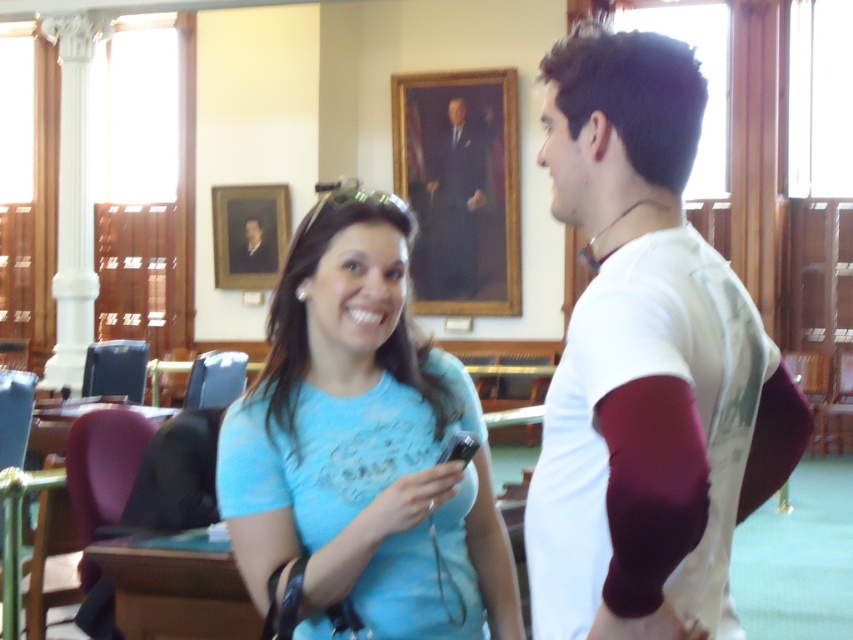
Is the position of blue cotton shirt at center less distant than that of white cotton t-shirt at center?

Yes.

Who is positioned more to the right, blue cotton shirt at center or white cotton t-shirt at center?

From the viewer's perspective, white cotton t-shirt at center appears more on the right side.

Image resolution: width=853 pixels, height=640 pixels. I want to click on blue cotton shirt at center, so click(646, 364).

From the picture: Does blue cotton shirt at center lie behind formal suit at center?

→ No, blue cotton shirt at center is closer to the viewer.

Between blue cotton shirt at center and formal suit at center, which one has more height?

Standing taller between the two is formal suit at center.

Between point (560, 541) and point (456, 189), which one is positioned in front?

Point (560, 541)

At what (x,y) coordinates should I click in order to perform the action: click on blue cotton shirt at center. Please return your answer as a coordinate pair (x, y). The height and width of the screenshot is (640, 853). Looking at the image, I should click on (646, 364).

From the picture: Is white cotton t-shirt at center closer to the viewer compared to formal suit at center?

That is True.

Is white cotton t-shirt at center positioned at the back of formal suit at center?

No, white cotton t-shirt at center is in front of formal suit at center.

Is point (735, 307) positioned after point (479, 234)?

No, it is not.

You are a GUI agent. You are given a task and a screenshot of the screen. Output one action in this format:
    pyautogui.click(x=<x>, y=<y>)
    Task: Click on the white cotton t-shirt at center
    Image resolution: width=853 pixels, height=640 pixels.
    Given the screenshot: What is the action you would take?
    pyautogui.click(x=646, y=364)